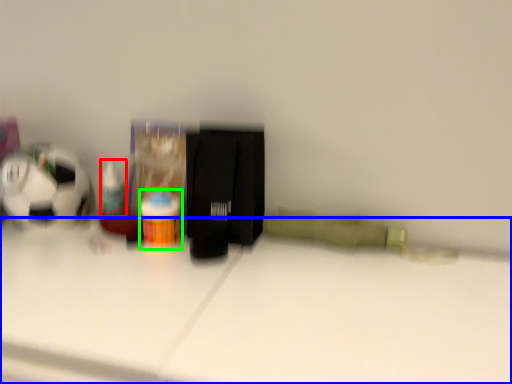
Question: Which is nearer to the toiletry (highlighted by a red box)? table (highlighted by a blue box) or bottle (highlighted by a green box).

Choices:
 (A) table
 (B) bottle

Answer: (B)